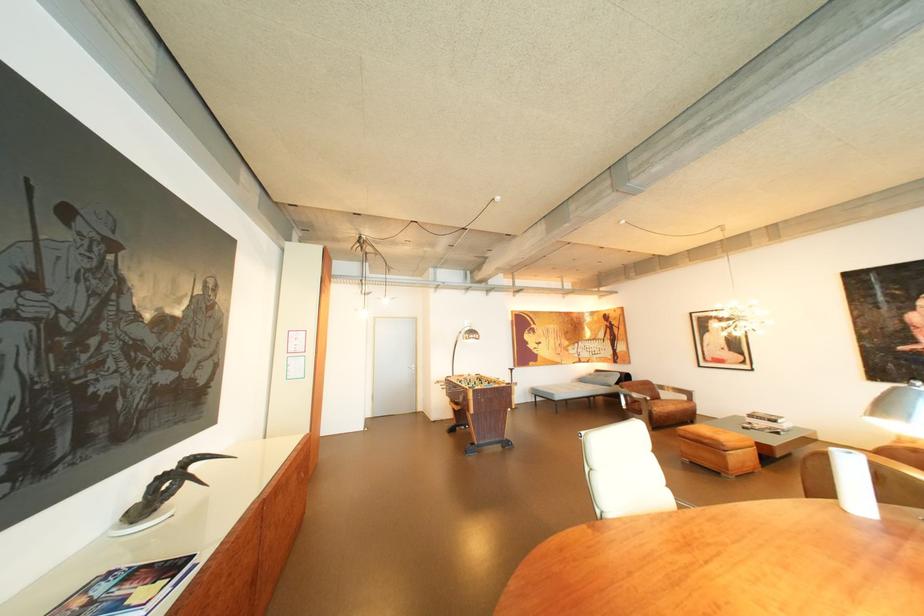
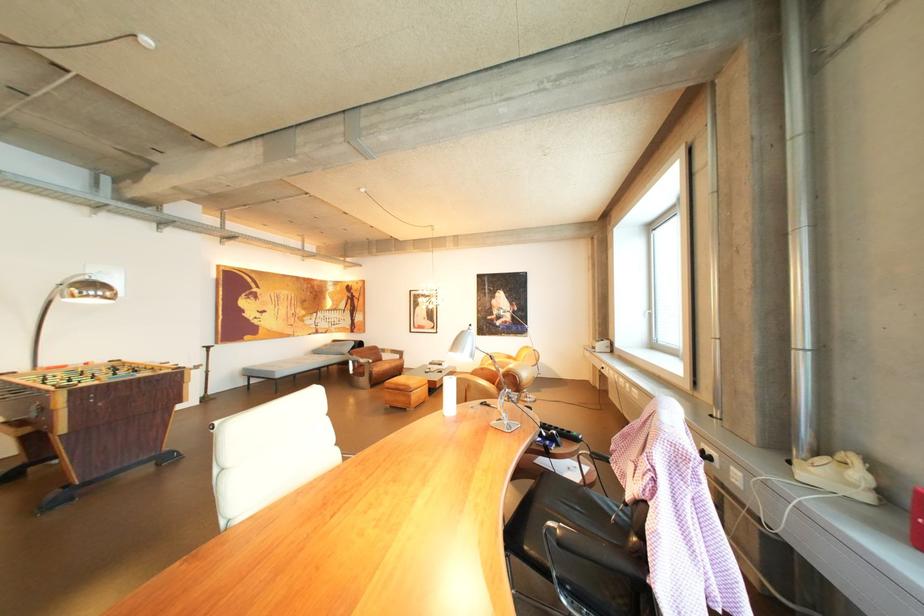
The point at [896,407] is marked in the first image. Where is the corresponding point in the second image?

(469, 345)